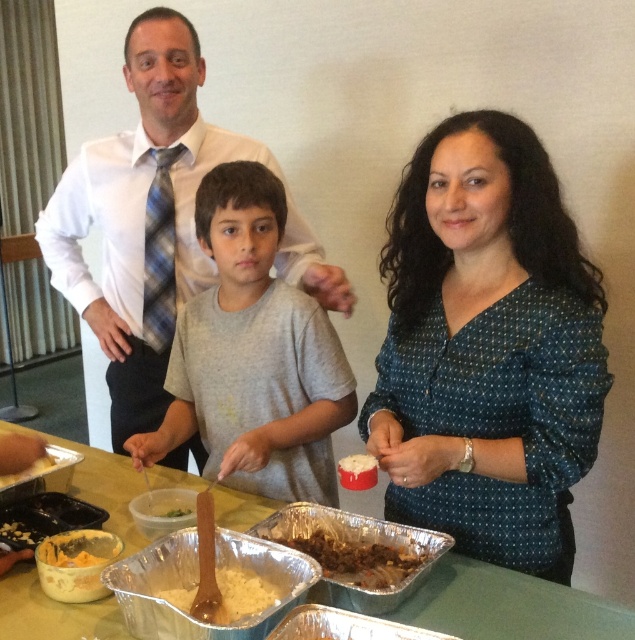
You are a photographer trying to capture a closeup of the green matte food at center without including the gray cotton shirt at center in the frame. Based on their positions, is this possible?

The gray cotton shirt at center might be wider than green matte food at center, so it may be challenging to capture the green matte food at center without including the gray cotton shirt at center in the frame due to their proximity in width.

You are a food safety inspector checking the distance between the white shirt at center and the green matte food at center. According to health regulations, the minimum safe distance between food and clothing is 12 inches. Is the current distance compliant with the regulation?

The distance between the white shirt at center and the green matte food at center is 29.89 inches, which exceeds the minimum required 12 inches, so it is compliant with health regulations.